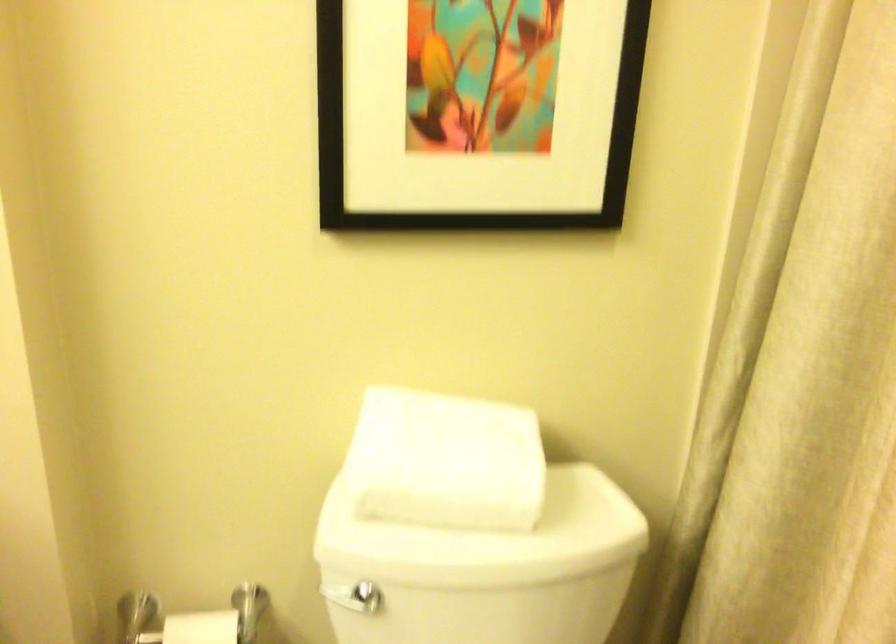
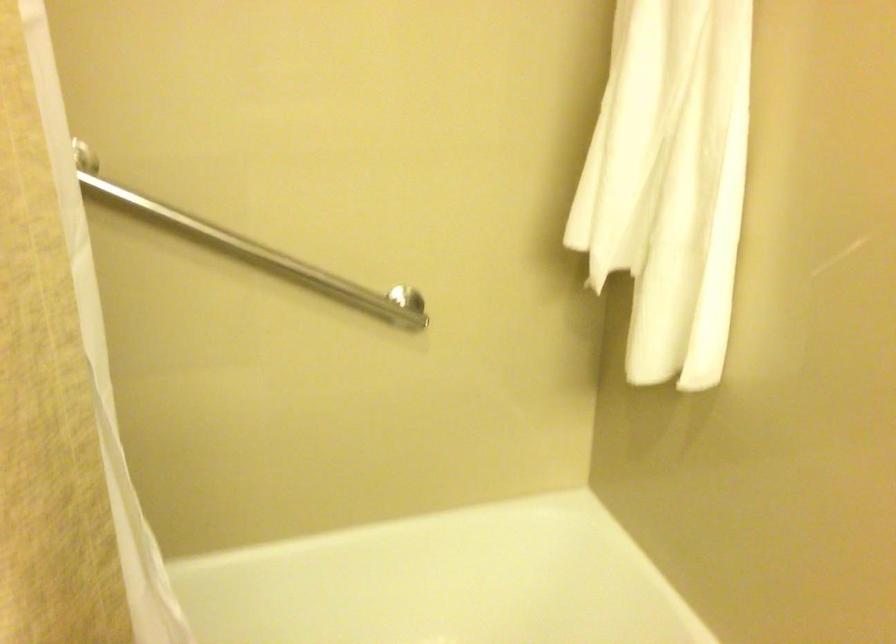
First-person continuous shooting, in which direction is the camera rotating?

The camera rotated toward right-down.